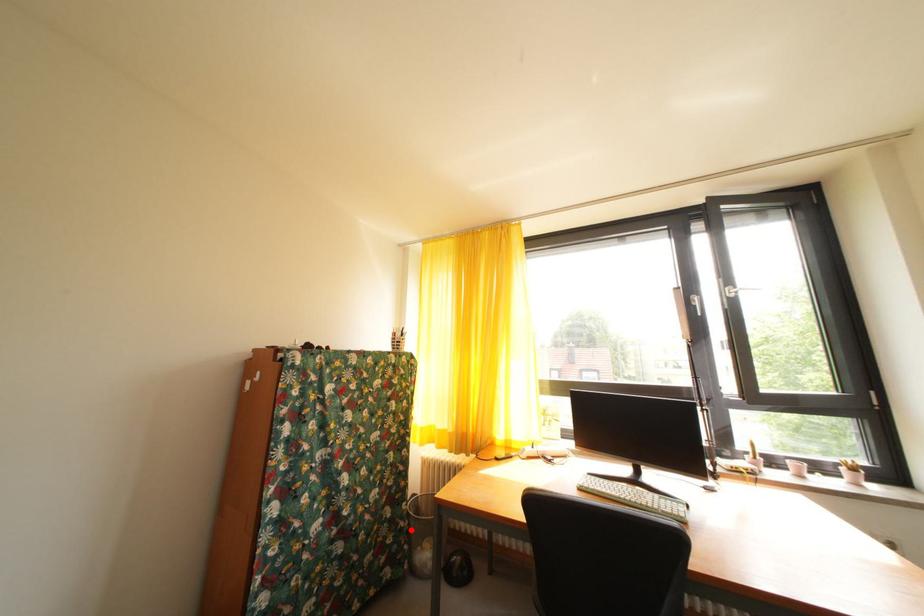
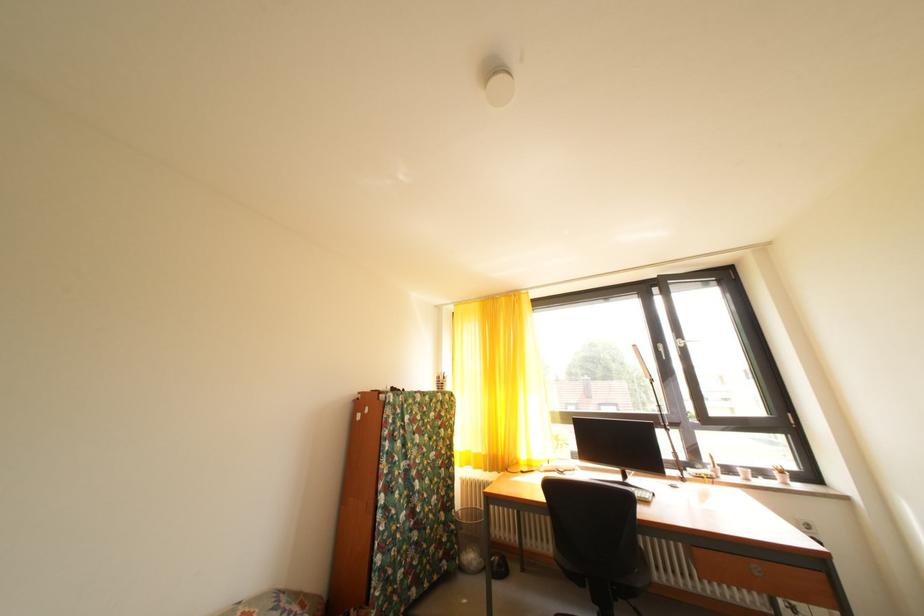
Question: I am providing you with two images of the same scene from different viewpoints. Given a red point in image1, look at the same physical point in image2. Is it:

Choices:
 (A) Closer to the viewpoint
 (B) Farther from the viewpoint

Answer: (B)